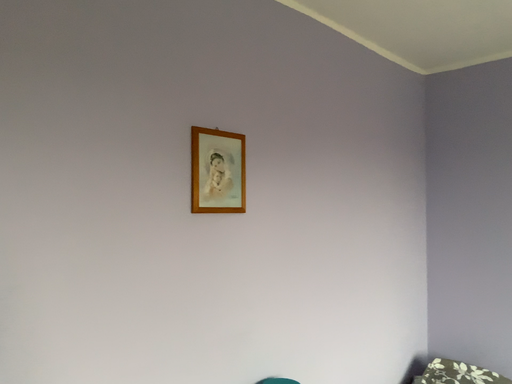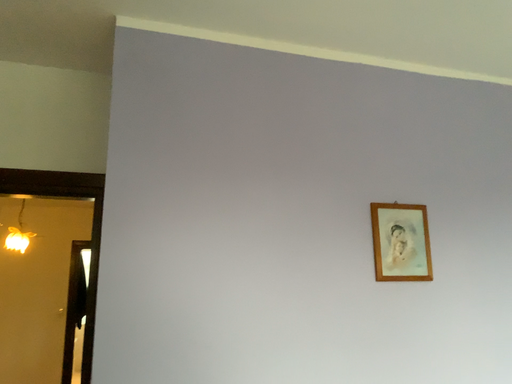
Question: Which way did the camera rotate in the video?

Choices:
 (A) rotated left
 (B) rotated right

Answer: (A)